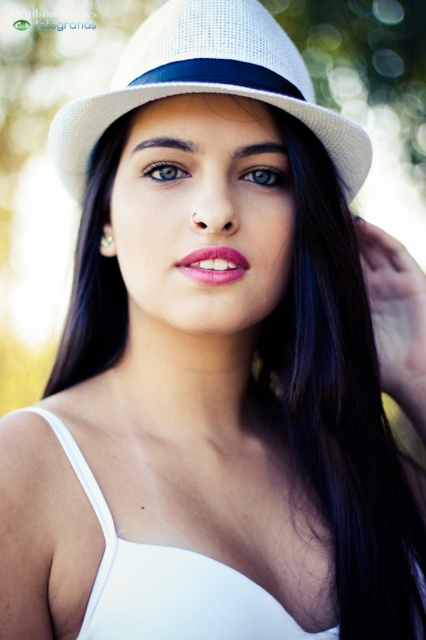
Question: Which point is farther to the camera?

Choices:
 (A) white woven fedora at upper center
 (B) pink glossy lips at center
 (C) blue glossy eye at upper center
 (D) green matte eye at center

Answer: (D)

Question: Is white woven fedora at upper center smaller than blue glossy eye at upper center?

Choices:
 (A) yes
 (B) no

Answer: (B)

Question: Which of the following is the farthest from the observer?

Choices:
 (A) (74, 104)
 (B) (172, 604)
 (C) (285, 179)

Answer: (C)

Question: Which point is farther to the camera?

Choices:
 (A) blue glossy eye at upper center
 (B) white fabric dress at center

Answer: (A)

Question: Can you confirm if white woven fedora at upper center is positioned to the left of white fabric dress at center?

Choices:
 (A) no
 (B) yes

Answer: (A)

Question: Is white woven fedora at upper center closer to camera compared to white fabric dress at center?

Choices:
 (A) yes
 (B) no

Answer: (B)